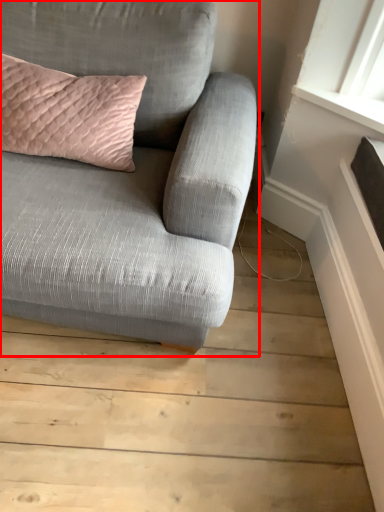
Question: From the image's perspective, where is studio couch (annotated by the red box) located relative to pillow?

Choices:
 (A) above
 (B) below

Answer: (B)